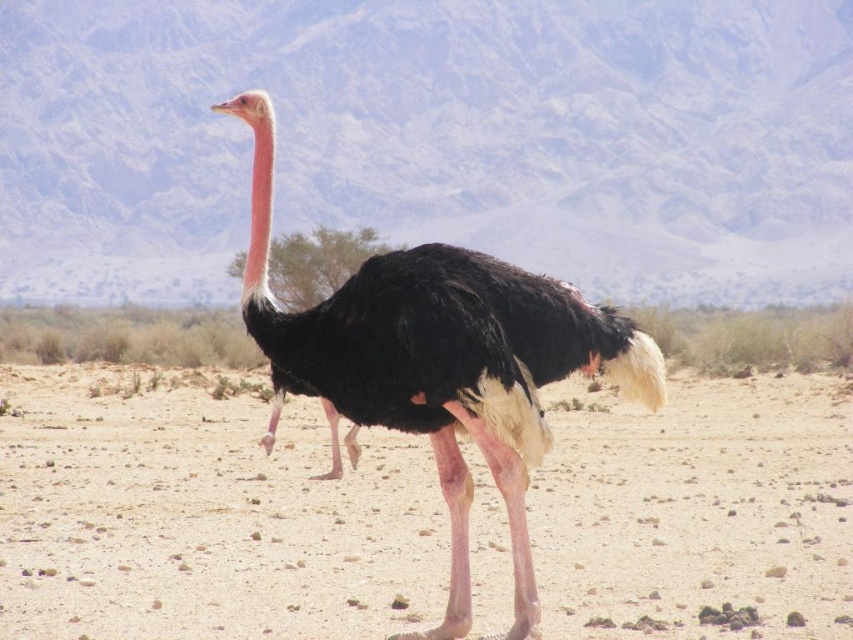
You are an ornithologist observing the black feathered ostrich at center and the white matte head at center. Which object is positioned higher in the image?

The white matte head at center is positioned higher in the image because the black feathered ostrich at center is located below it.

Based on the photo, you are an archaeologist searching for artifacts in the desert. You notice the brown sandy dirt at center and the black feathered ostrich at center. Which object is located to the right of the other?

The brown sandy dirt at center is positioned on the left side of black feathered ostrich at center, so the black feathered ostrich at center is to the right of the brown sandy dirt at center.

You are an archaeologist holding a metal detector that has a maximum range of 8 meters. You are currently standing on the brown sandy dirt at center and want to scan the white matte head at center. Can your metal detector reach that location?

The distance between the brown sandy dirt at center and the white matte head at center is 8.75 meters, which exceeds the metal detector range of 8 meters. Therefore, the metal detector cannot reach the white matte head at center.